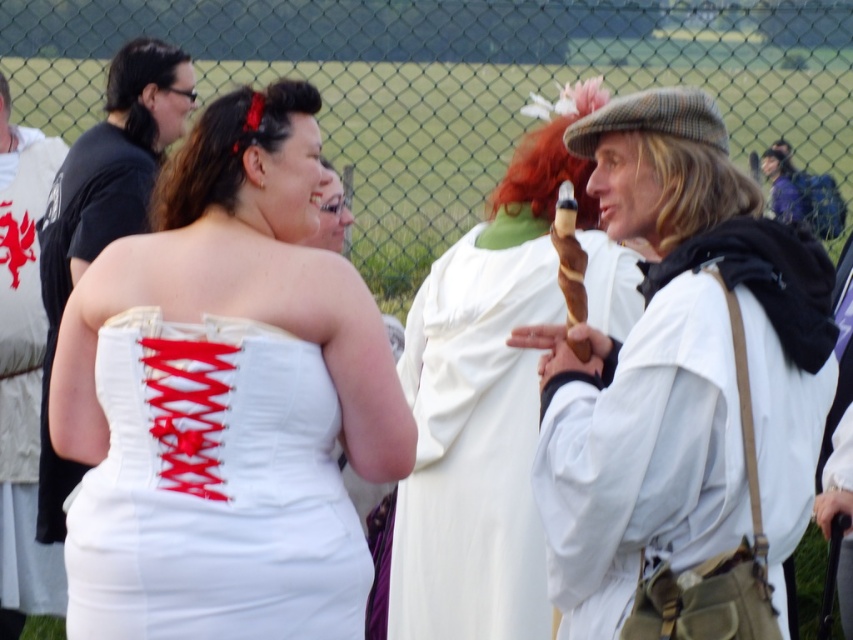
You are a photographer at the festival and want to capture a photo of both the matte white dress at center and the white satin corset at left. From the perspective of someone standing in front of the scene, which object is located to the left of the other?

The white satin corset at left is positioned to the left of the matte white dress at center.

In the scene shown: You are a photographer at the festival and want to take a photo focusing on the white cloth at center and the white satin corset at left. Which object should you adjust your camera focus on first if you want to ensure both are in focus?

The white cloth at center is closer to the viewer than the white satin corset at left, so you should focus on the white cloth at center first to ensure both are in focus.

You are a costume designer preparing for a play. You have two white items in the scene. The white cloth at center and the white satin corset at left. Which one is bigger in size?

The white cloth at center is larger in size compared to the white satin corset at left according to the description.